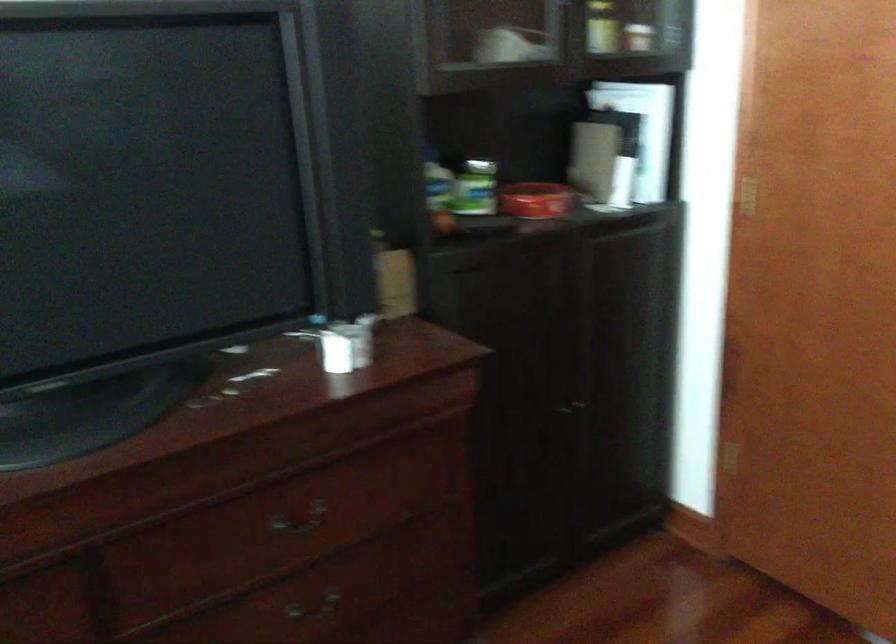
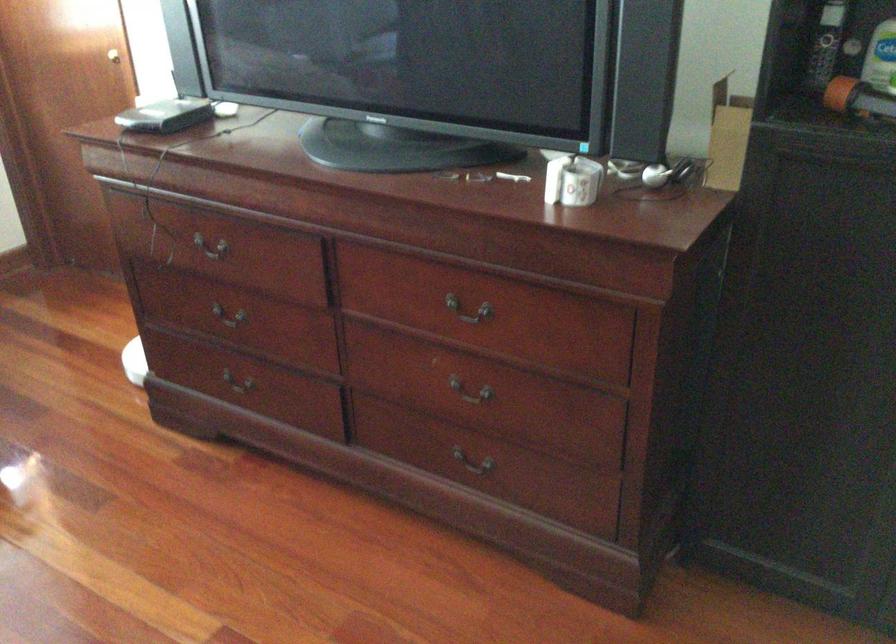
The point at (337, 345) is marked in the first image. Where is the corresponding point in the second image?

(572, 180)